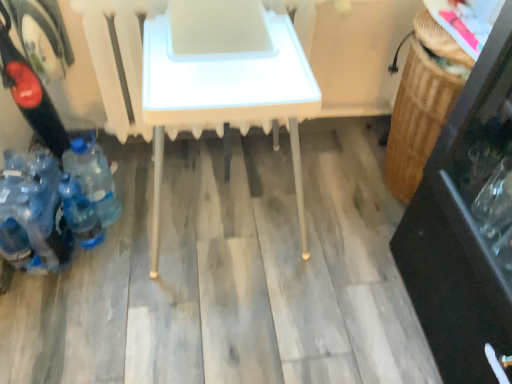
Identify the location of vacant area located to the right-hand side of white plastic table at center. (348, 252).